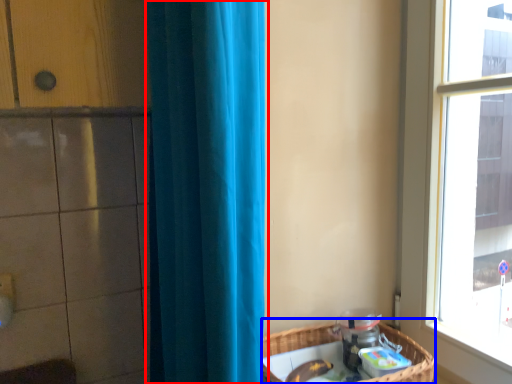
Question: Which point is further to the camera, curtain (highlighted by a red box) or basket (highlighted by a blue box)?

Choices:
 (A) curtain
 (B) basket

Answer: (B)